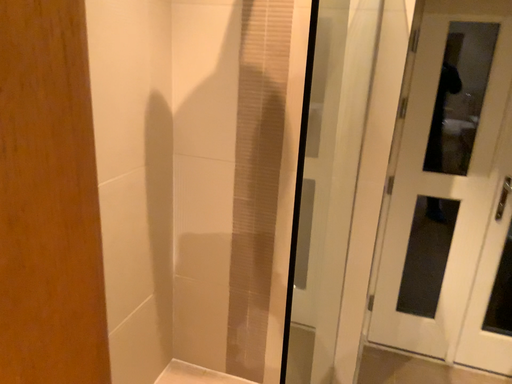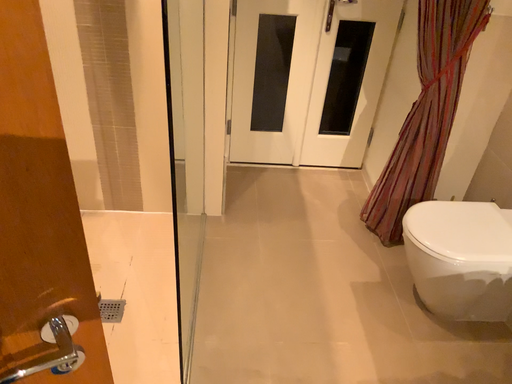
Question: How did the camera likely rotate when shooting the video?

Choices:
 (A) rotated right
 (B) rotated left

Answer: (A)